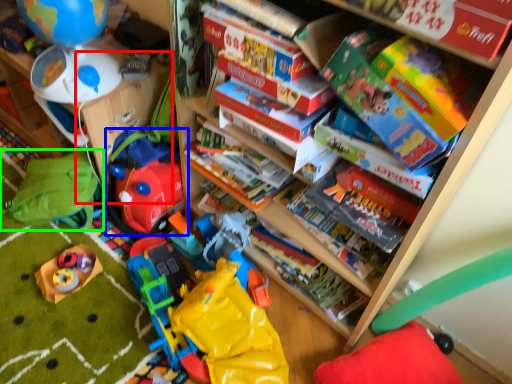
Question: Which object is the farthest from shelf (highlighted by a red box)? Choose among these: toy (highlighted by a blue box) or toy (highlighted by a green box).

Choices:
 (A) toy
 (B) toy

Answer: (B)